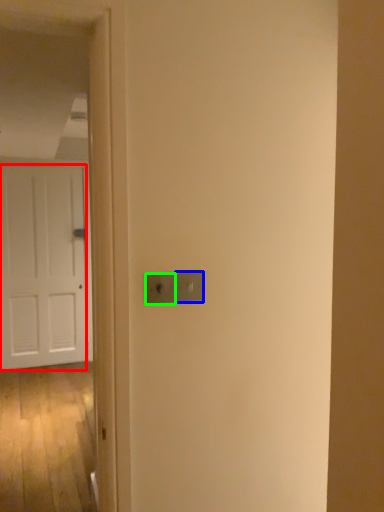
Question: Which object is positioned closest to door (highlighted by a red box)? Select from light switch (highlighted by a blue box) and light switch (highlighted by a green box).

Choices:
 (A) light switch
 (B) light switch

Answer: (B)